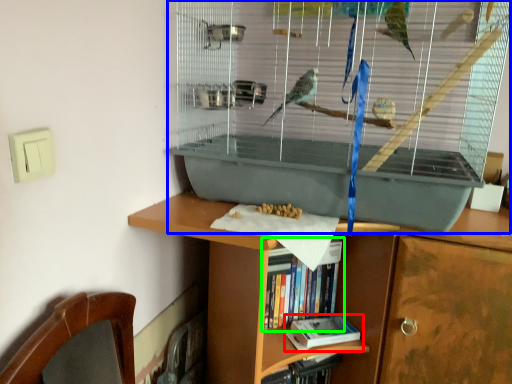
Question: Which object is positioned closest to book (highlighted by a red box)? Select from bird cage (highlighted by a blue box) and book (highlighted by a green box).

Choices:
 (A) bird cage
 (B) book

Answer: (B)